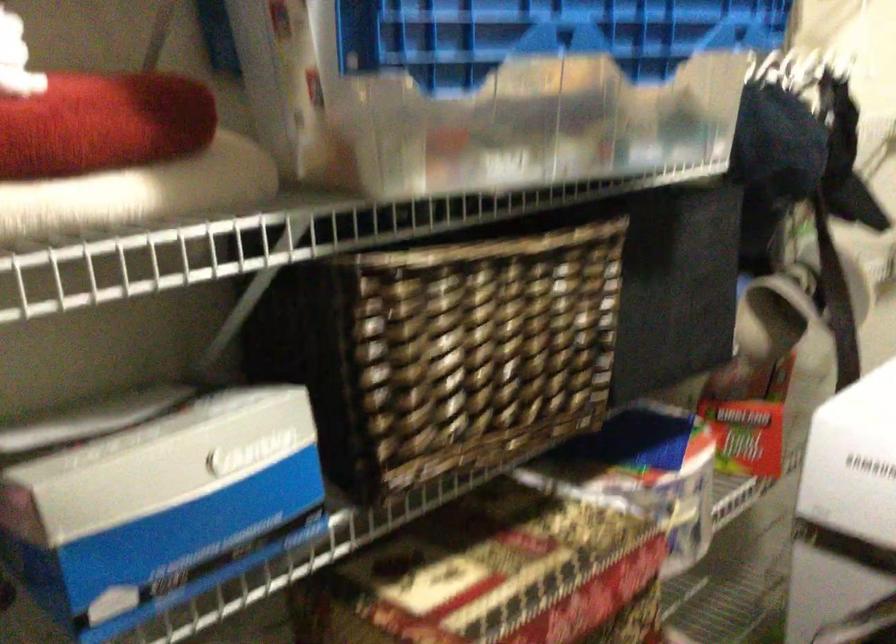
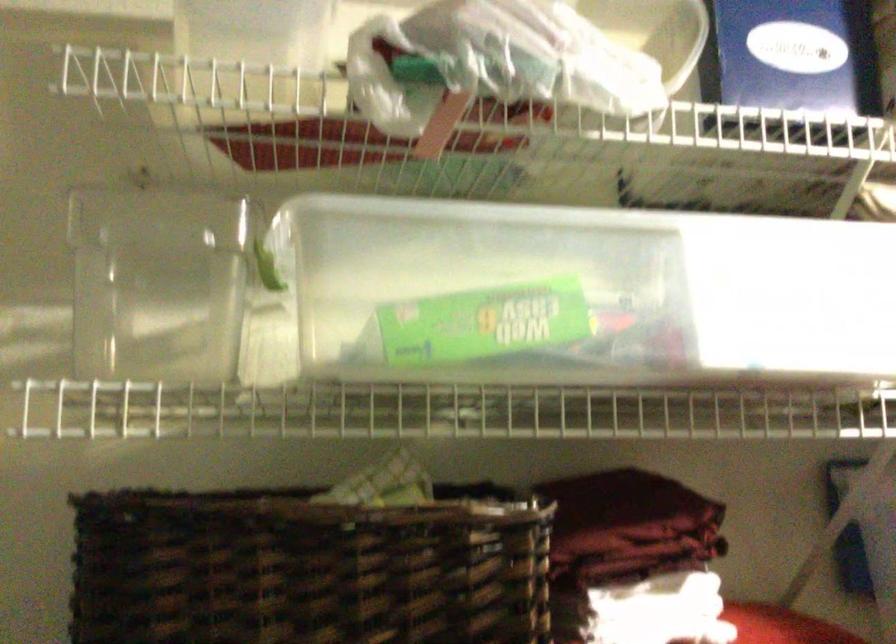
Based on the continuous images, in which direction is the camera rotating?

The camera rotated toward left-up.